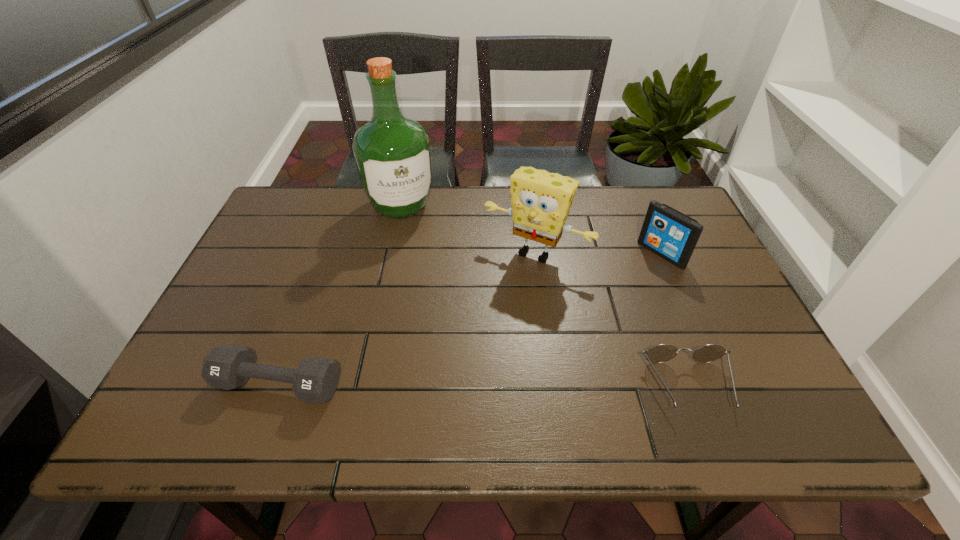
Find the location of a particular element. object present at the left edge is located at coordinates (315, 380).

The width and height of the screenshot is (960, 540). What are the coordinates of `spectacles located at the right edge` in the screenshot? It's located at point(660,353).

You are a GUI agent. You are given a task and a screenshot of the screen. Output one action in this format:
    pyautogui.click(x=<x>, y=<y>)
    Task: Click on the iPod that is at the right edge
    The height and width of the screenshot is (540, 960).
    Given the screenshot: What is the action you would take?
    pyautogui.click(x=672, y=235)

This screenshot has height=540, width=960. Identify the location of object located at the near left corner. (315, 380).

Identify the location of object situated at the near right corner. This screenshot has height=540, width=960. (660, 353).

The height and width of the screenshot is (540, 960). I want to click on free location at the far edge of the desktop, so click(x=495, y=218).

Locate an element on the screen. The height and width of the screenshot is (540, 960). free region at the left edge of the desktop is located at coordinates (237, 341).

Locate an element on the screen. The width and height of the screenshot is (960, 540). vacant space at the right edge of the desktop is located at coordinates (693, 334).

This screenshot has width=960, height=540. What are the coordinates of `free spot at the far left corner of the desktop` in the screenshot? It's located at (279, 212).

This screenshot has width=960, height=540. Find the location of `free space at the far right corner of the desktop`. free space at the far right corner of the desktop is located at coordinates (668, 187).